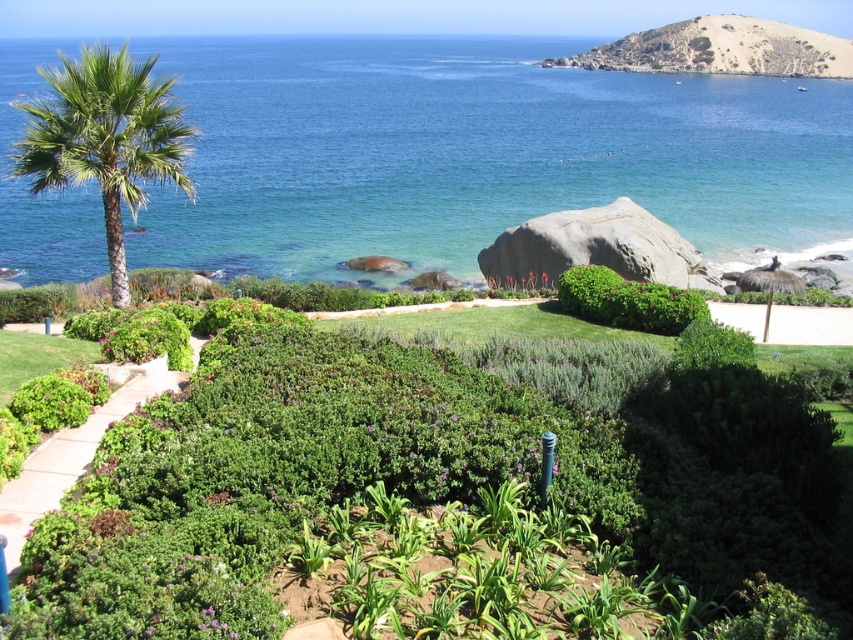
Measure the distance between green leafy palm tree at left and camera.

The distance of green leafy palm tree at left from camera is 15.45 meters.

Who is more forward, (91, 156) or (666, 326)?

Point (91, 156) is more forward.

Locate an element on the screen. The image size is (853, 640). green leafy palm tree at left is located at coordinates (105, 138).

Between point (79, 428) and point (601, 300), which one is positioned in front?

Point (79, 428) is in front.

Consider the image. Which of these two, green grass at lower left or green leafy bush at center, stands taller?

Standing taller between the two is green leafy bush at center.

Which is in front, point (193, 349) or point (576, 268)?

Positioned in front is point (193, 349).

This screenshot has height=640, width=853. In order to click on green grass at lower left in this screenshot , I will do `click(73, 456)`.

Who is lower down, green leafy palm tree at left or green grass at lower left?

green grass at lower left is lower down.

This screenshot has width=853, height=640. What are the coordinates of `green leafy palm tree at left` in the screenshot? It's located at pyautogui.click(x=105, y=138).

Where is `green leafy palm tree at left`? The image size is (853, 640). green leafy palm tree at left is located at coordinates (105, 138).